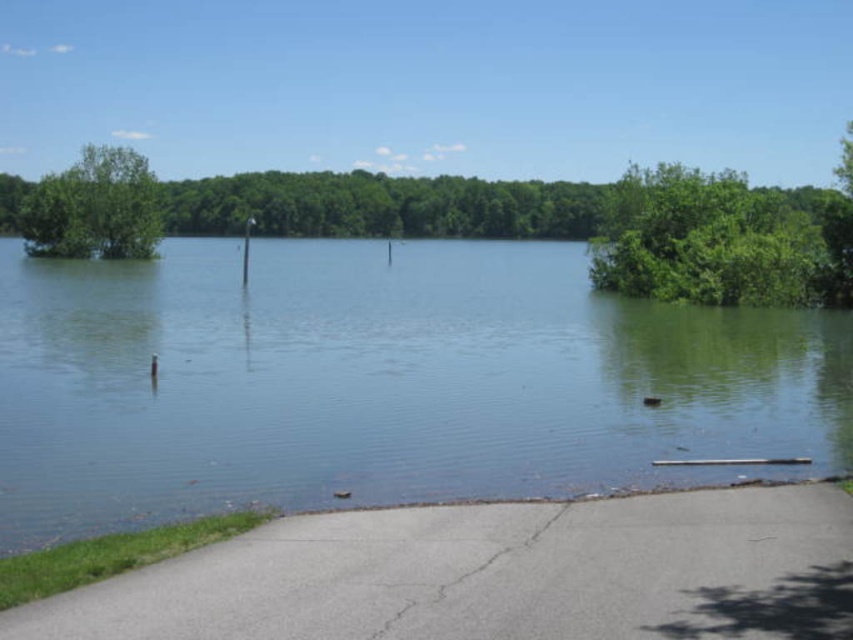
Does clear water at center appear under green leafy tree at upper right?

Correct, clear water at center is located below green leafy tree at upper right.

Does clear water at center have a greater width compared to green leafy tree at upper right?

Incorrect, clear water at center's width does not surpass green leafy tree at upper right's.

Where is `clear water at center`? This screenshot has width=853, height=640. clear water at center is located at coordinates (381, 381).

Find the location of a particular element. The image size is (853, 640). clear water at center is located at coordinates (381, 381).

Can you confirm if green leafy tree at upper right is positioned to the right of green leafy tree at upper left?

Yes, green leafy tree at upper right is to the right of green leafy tree at upper left.

Between green leafy tree at upper right and green leafy tree at upper left, which one appears on the left side from the viewer's perspective?

From the viewer's perspective, green leafy tree at upper left appears more on the left side.

Find the location of a particular element. The width and height of the screenshot is (853, 640). green leafy tree at upper right is located at coordinates (723, 241).

This screenshot has width=853, height=640. In order to click on green leafy tree at upper right in this screenshot , I will do `click(723, 241)`.

Does clear water at center have a lesser width compared to green leafy tree at upper left?

Indeed, clear water at center has a lesser width compared to green leafy tree at upper left.

Is clear water at center positioned behind green leafy tree at upper left?

No, clear water at center is in front of green leafy tree at upper left.

I want to click on clear water at center, so click(381, 381).